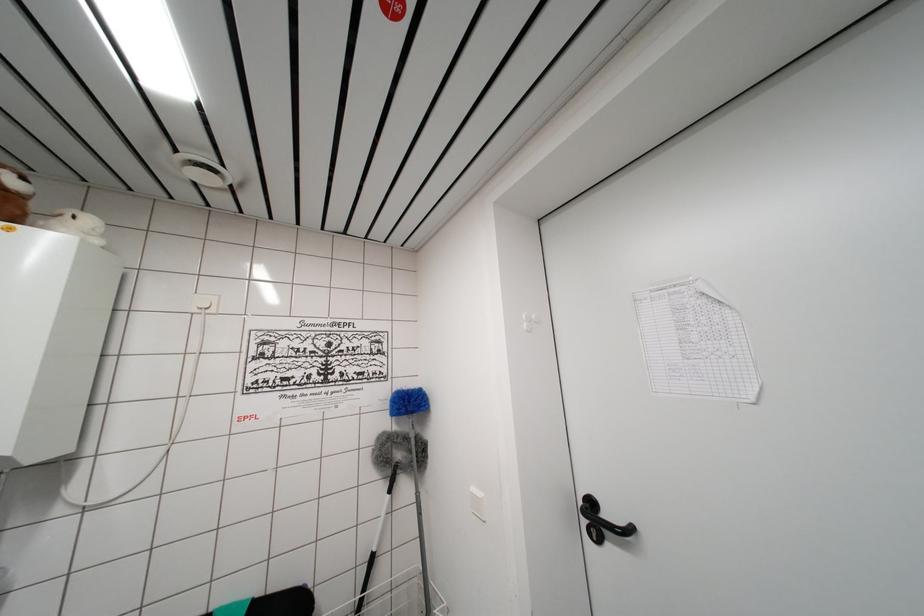
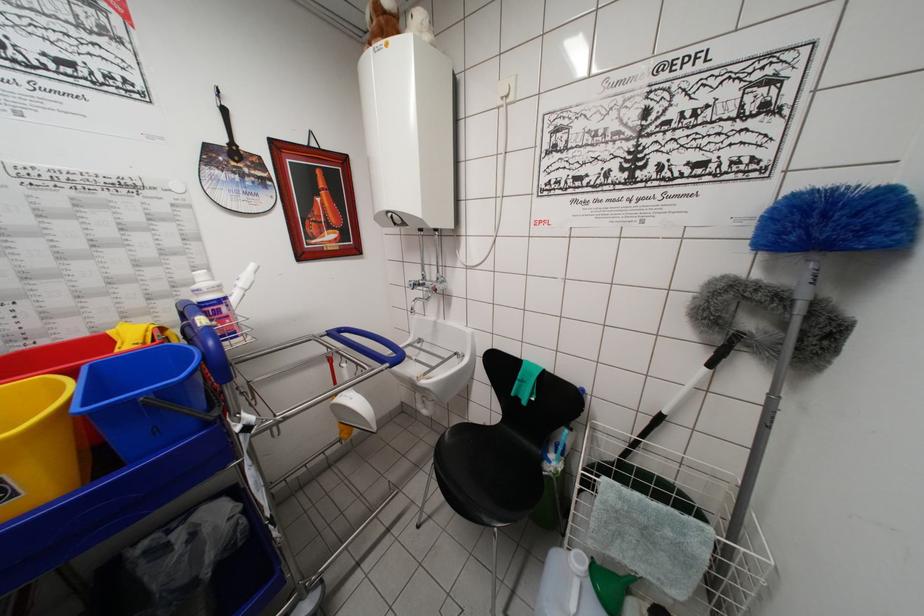
Based on the continuous images, in which direction is the camera rotating?

The camera rotated toward left-down.